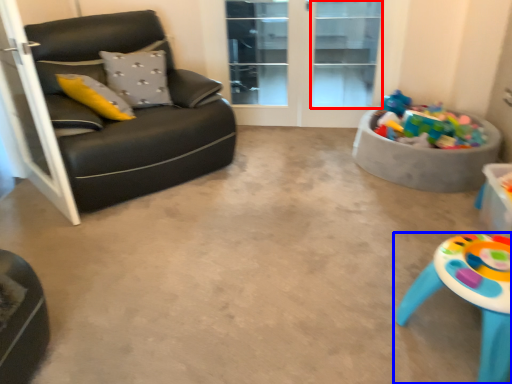
Question: Which object is further to the camera taking this photo, window (highlighted by a red box) or table (highlighted by a blue box)?

Choices:
 (A) window
 (B) table

Answer: (A)